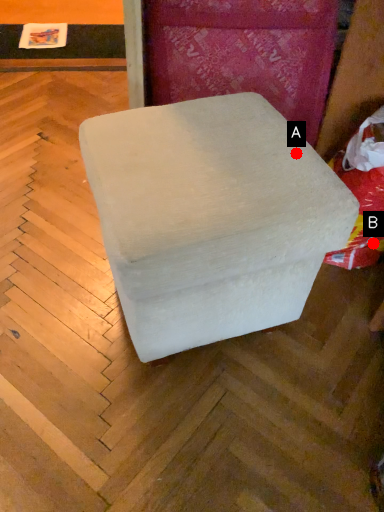
Question: Two points are circled on the image, labeled by A and B beside each circle. Which point is closer to the camera taking this photo?

Choices:
 (A) A is closer
 (B) B is closer

Answer: (A)